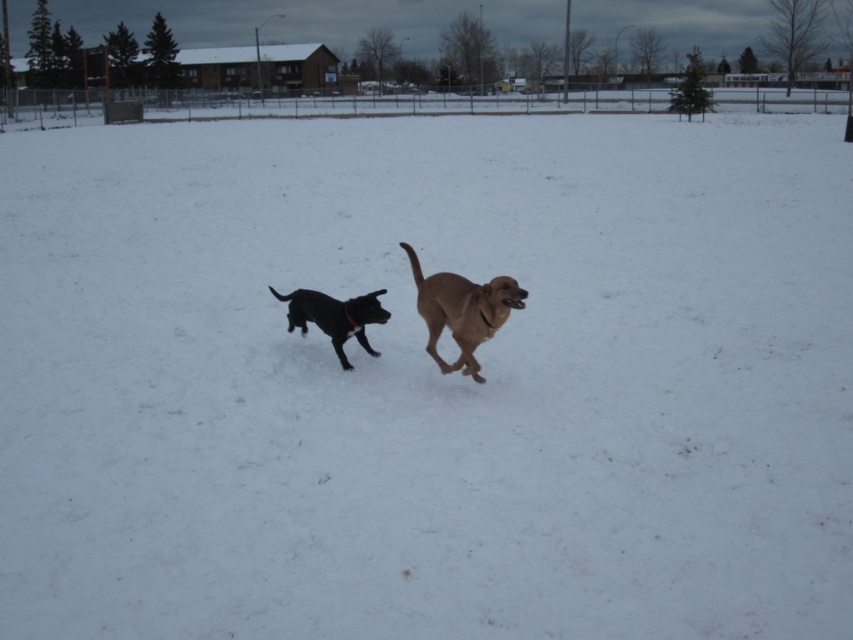
Question: Is golden brown fur at center thinner than shiny black dog at center?

Choices:
 (A) yes
 (B) no

Answer: (A)

Question: Is golden brown fur at center thinner than shiny black dog at center?

Choices:
 (A) no
 (B) yes

Answer: (B)

Question: Which of the following is the closest to the observer?

Choices:
 (A) (454, 275)
 (B) (358, 326)

Answer: (A)

Question: Is golden brown fur at center to the right of shiny black dog at center from the viewer's perspective?

Choices:
 (A) yes
 (B) no

Answer: (A)

Question: Which of the following is the closest to the observer?

Choices:
 (A) (299, 320)
 (B) (432, 280)

Answer: (B)

Question: Which point is farther to the camera?

Choices:
 (A) (328, 300)
 (B) (479, 368)

Answer: (A)